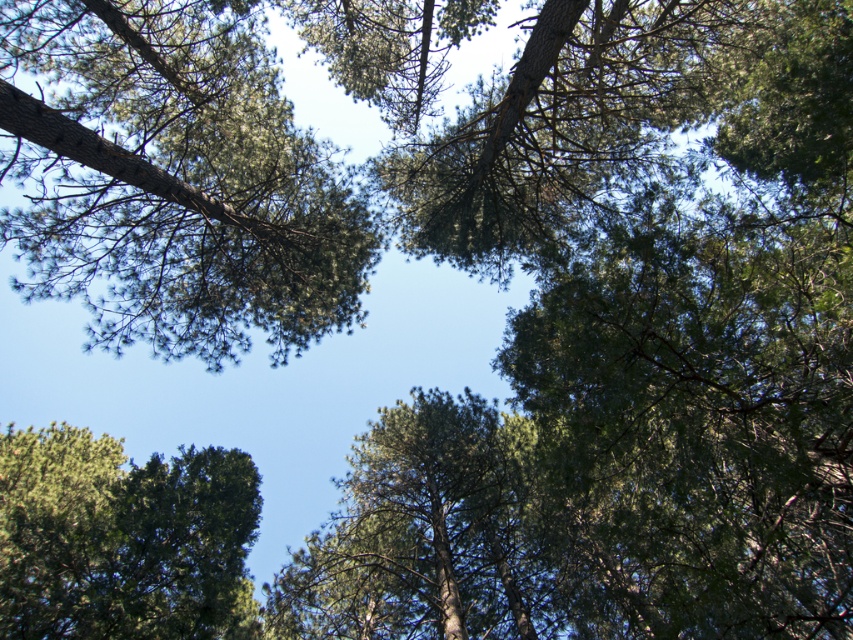
You are standing under the trees and looking up. You see the green textured tree at upper left and the green textured tree at lower left. Which tree is positioned more to the right side from your viewpoint?

The green textured tree at upper left is positioned more to the right side compared to the green textured tree at lower left.

You are a bird flying through the forest and need to choose a path between the green textured tree at upper left and the green textured tree at lower left. Which tree has a narrower trunk to navigate around?

The green textured tree at upper left is thinner than the green textured tree at lower left, so it has a narrower trunk to navigate around.

You are standing under a forest canopy and looking up. You notice two trees, the green textured tree at upper left and the green textured tree at lower left. Which tree is closer to you?

The green textured tree at upper left is closer to you because the green textured tree at lower left is behind it.